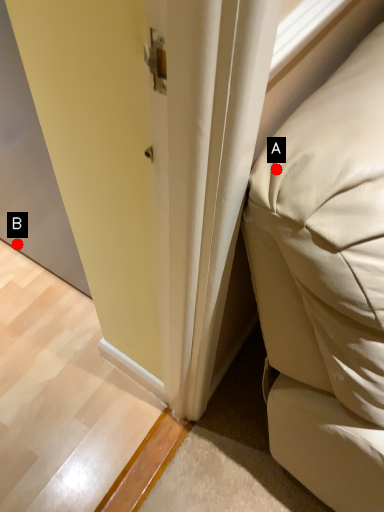
Question: Two points are circled on the image, labeled by A and B beside each circle. Among these points, which one is farthest from the camera?

Choices:
 (A) A is further
 (B) B is further

Answer: (B)